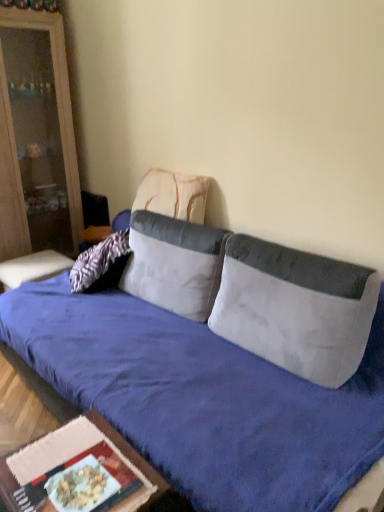
Question: Is textured beige pillow at center, marked as the first pillow in a back-to-front arrangement, not inside white fabric pillow at center, arranged as the second pillow when viewed from the back?

Choices:
 (A) no
 (B) yes

Answer: (B)

Question: Does textured beige pillow at center, the third pillow positioned from the front, have a greater width compared to white fabric pillow at center, arranged as the second pillow when viewed from the back?

Choices:
 (A) no
 (B) yes

Answer: (A)

Question: Is textured beige pillow at center, the third pillow positioned from the front, bigger than white fabric pillow at center, acting as the 2th pillow starting from the front?

Choices:
 (A) no
 (B) yes

Answer: (A)

Question: Is textured beige pillow at center, the third pillow positioned from the front, to the left of white fabric pillow at center, acting as the 2th pillow starting from the front, from the viewer's perspective?

Choices:
 (A) no
 (B) yes

Answer: (B)

Question: From the image's perspective, is textured beige pillow at center, the third pillow positioned from the front, on top of white fabric pillow at center, acting as the 2th pillow starting from the front?

Choices:
 (A) yes
 (B) no

Answer: (A)

Question: From a real-world perspective, is textured beige pillow at center, the third pillow positioned from the front, under white fabric pillow at center, acting as the 2th pillow starting from the front?

Choices:
 (A) no
 (B) yes

Answer: (A)

Question: Does white fabric pillow at center, arranged as the second pillow when viewed from the back, appear on the left side of matte wood cabinet at left?

Choices:
 (A) no
 (B) yes

Answer: (A)

Question: Can you confirm if white fabric pillow at center, acting as the 2th pillow starting from the front, is shorter than matte wood cabinet at left?

Choices:
 (A) yes
 (B) no

Answer: (A)

Question: From the image's perspective, is white fabric pillow at center, arranged as the second pillow when viewed from the back, beneath matte wood cabinet at left?

Choices:
 (A) no
 (B) yes

Answer: (B)

Question: Can you confirm if white fabric pillow at center, acting as the 2th pillow starting from the front, is positioned to the right of matte wood cabinet at left?

Choices:
 (A) yes
 (B) no

Answer: (A)

Question: Are white fabric pillow at center, acting as the 2th pillow starting from the front, and matte wood cabinet at left far apart?

Choices:
 (A) yes
 (B) no

Answer: (A)

Question: Could you tell me if white fabric pillow at center, acting as the 2th pillow starting from the front, is turned towards matte wood cabinet at left?

Choices:
 (A) yes
 (B) no

Answer: (B)

Question: Does velvet blue studio couch at center turn towards wooden table at lower left?

Choices:
 (A) no
 (B) yes

Answer: (B)